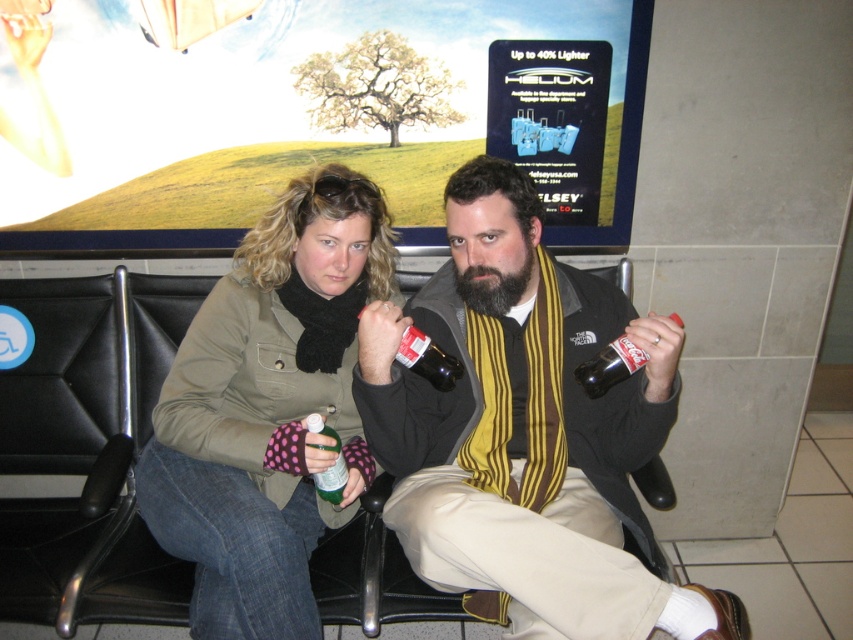
Question: Which of the following is the closest to the observer?

Choices:
 (A) 457,365
 (B) 633,365

Answer: (B)

Question: Which point is closer to the camera taking this photo?

Choices:
 (A) (593, 385)
 (B) (305, 456)

Answer: (B)

Question: From the image, what is the correct spatial relationship of matte green jacket at center in relation to green glass bottle at center?

Choices:
 (A) below
 (B) above

Answer: (B)

Question: Considering the real-world distances, which object is farthest from the matte glass bottle at right?

Choices:
 (A) green glass bottle at center
 (B) matte black jacket at center
 (C) dark glass bottle at center

Answer: (A)

Question: In this image, where is matte black jacket at center located relative to matte green jacket at center?

Choices:
 (A) left
 (B) right

Answer: (B)

Question: Is matte green jacket at center bigger than matte glass bottle at right?

Choices:
 (A) yes
 (B) no

Answer: (A)